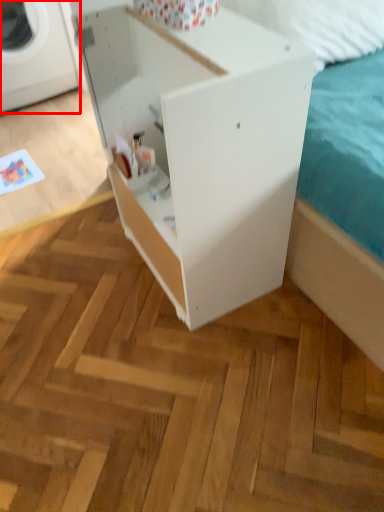
Question: Observing the image, what is the correct spatial positioning of washing machine (annotated by the red box) in reference to furniture?

Choices:
 (A) left
 (B) right

Answer: (A)